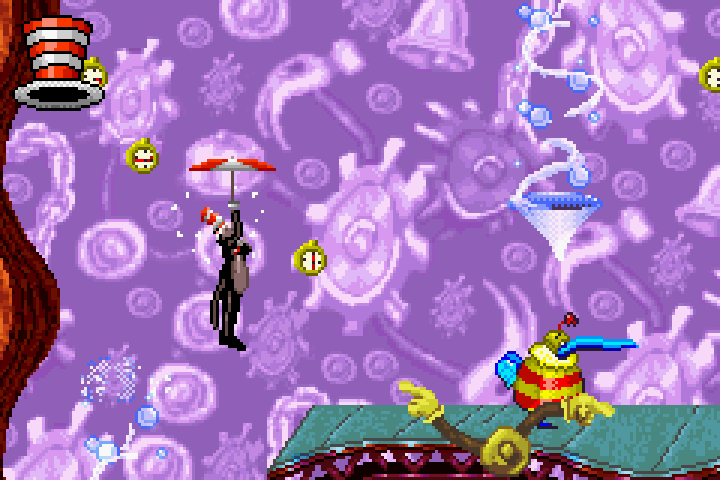
Locate an element on the screen. This screenshot has width=720, height=480. gold clocks is located at coordinates (309, 254), (147, 153), (94, 67), (716, 75).